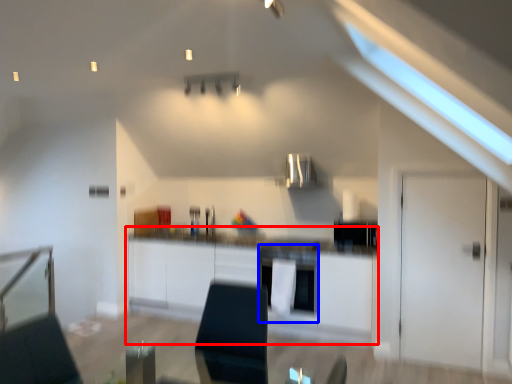
Question: Which of the following is the farthest to the observer, cabinetry (highlighted by a red box) or oven (highlighted by a blue box)?

Choices:
 (A) cabinetry
 (B) oven

Answer: (B)